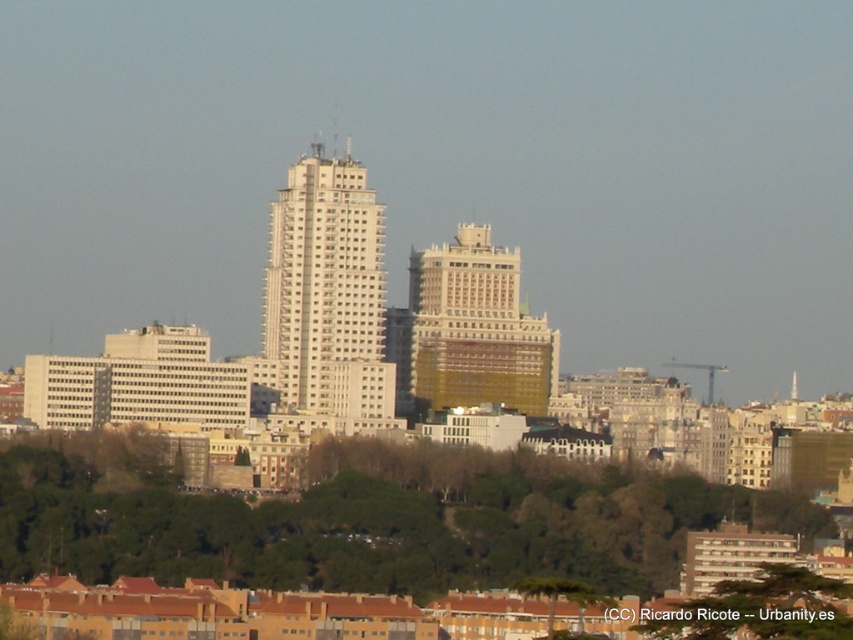
Does green leafy trees at lower center have a lesser width compared to green leafy tree at lower center?

In fact, green leafy trees at lower center might be wider than green leafy tree at lower center.

Which is above, green leafy trees at lower center or green leafy tree at lower center?

green leafy trees at lower center is above.

Is point (328, 531) farther from camera compared to point (759, 602)?

No, it is in front of (759, 602).

Locate an element on the screen. This screenshot has width=853, height=640. green leafy trees at lower center is located at coordinates (368, 518).

Which of these two, green leafy trees at lower center or white smooth building at center, stands taller?

Standing taller between the two is white smooth building at center.

Is green leafy trees at lower center smaller than white smooth building at center?

Actually, green leafy trees at lower center might be larger than white smooth building at center.

You are a GUI agent. You are given a task and a screenshot of the screen. Output one action in this format:
    pyautogui.click(x=<x>, y=<y>)
    Task: Click on the green leafy trees at lower center
    The image size is (853, 640).
    Given the screenshot: What is the action you would take?
    pyautogui.click(x=368, y=518)

Is point (366, 308) less distant than point (413, 374)?

Yes, point (366, 308) is in front of point (413, 374).

Does point (263, 371) lie behind point (413, 314)?

Yes, it is.

Does point (357, 280) come in front of point (410, 316)?

That is True.

The height and width of the screenshot is (640, 853). Identify the location of white smooth building at center. (326, 292).